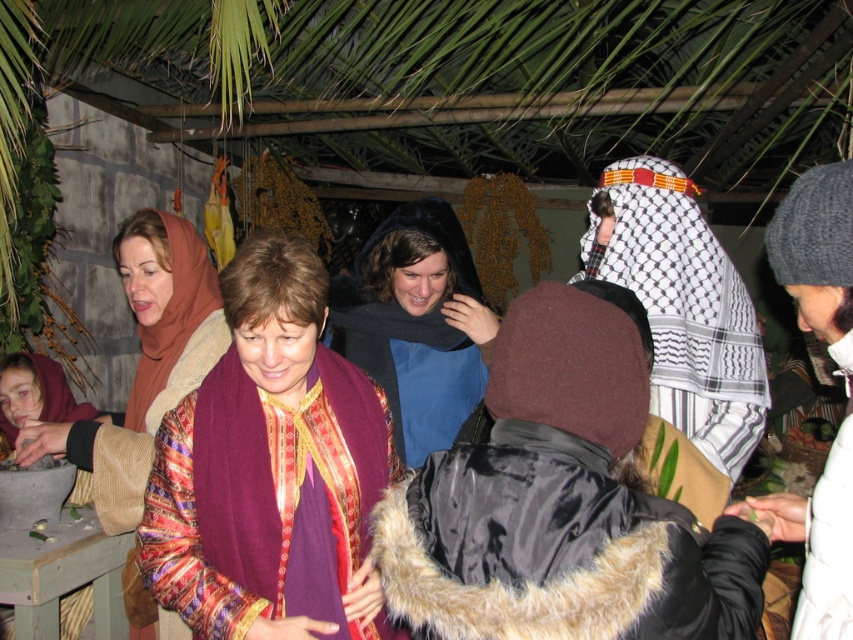
Is white checkered cloth at center further to the viewer compared to blue matte scarf at center?

No, it is in front of blue matte scarf at center.

Identify the location of white checkered cloth at center. Image resolution: width=853 pixels, height=640 pixels. (682, 305).

I want to click on white checkered cloth at center, so click(x=682, y=305).

Who is more forward, (x=379, y=547) or (x=701, y=364)?

Point (x=379, y=547) is more forward.

Is black satin coat at center below white checkered cloth at center?

Yes.

Between point (587, 451) and point (704, 362), which one is positioned in front?

Positioned in front is point (587, 451).

Locate an element on the screen. The height and width of the screenshot is (640, 853). black satin coat at center is located at coordinates (556, 548).

In the scene shown: Between blue matte scarf at center and multicolored fabric scarf at center, which one has more height?

With more height is multicolored fabric scarf at center.

In the scene shown: Which is more to the right, blue matte scarf at center or multicolored fabric scarf at center?

blue matte scarf at center

Between point (390, 333) and point (38, 454), which one is positioned in front?

Point (38, 454) is more forward.

Find the location of a particular element. The image size is (853, 640). blue matte scarf at center is located at coordinates (415, 323).